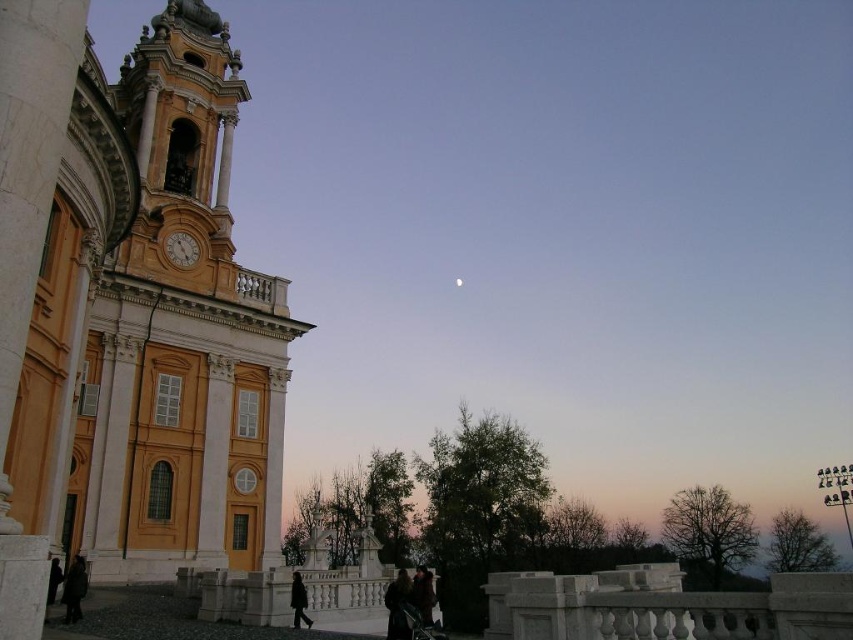
Between dark brown coat at lower center and white matte moon at upper center, which one has more height?

Standing taller between the two is dark brown coat at lower center.

Can you confirm if dark brown coat at lower center is positioned below white matte moon at upper center?

Yes, dark brown coat at lower center is below white matte moon at upper center.

Which is behind, point (399, 586) or point (459, 284)?

Positioned behind is point (459, 284).

Locate an element on the screen. The image size is (853, 640). dark brown coat at lower center is located at coordinates (398, 605).

Is point (305, 612) less distant than point (456, 284)?

Yes, it is in front of point (456, 284).

Is black wool coat at lower center shorter than white matte moon at upper center?

Incorrect, black wool coat at lower center's height does not fall short of white matte moon at upper center's.

The width and height of the screenshot is (853, 640). I want to click on black wool coat at lower center, so (x=299, y=600).

Based on the photo, does dark brown coat at lower left appear under wooden clock at upper left?

Yes.

Between point (71, 586) and point (172, 236), which one is positioned in front?

Point (71, 586)

Is point (77, 588) less distant than point (190, 253)?

Yes, it is in front of point (190, 253).

You are a GUI agent. You are given a task and a screenshot of the screen. Output one action in this format:
    pyautogui.click(x=<x>, y=<y>)
    Task: Click on the dark brown coat at lower left
    Image resolution: width=853 pixels, height=640 pixels.
    Given the screenshot: What is the action you would take?
    pyautogui.click(x=74, y=588)